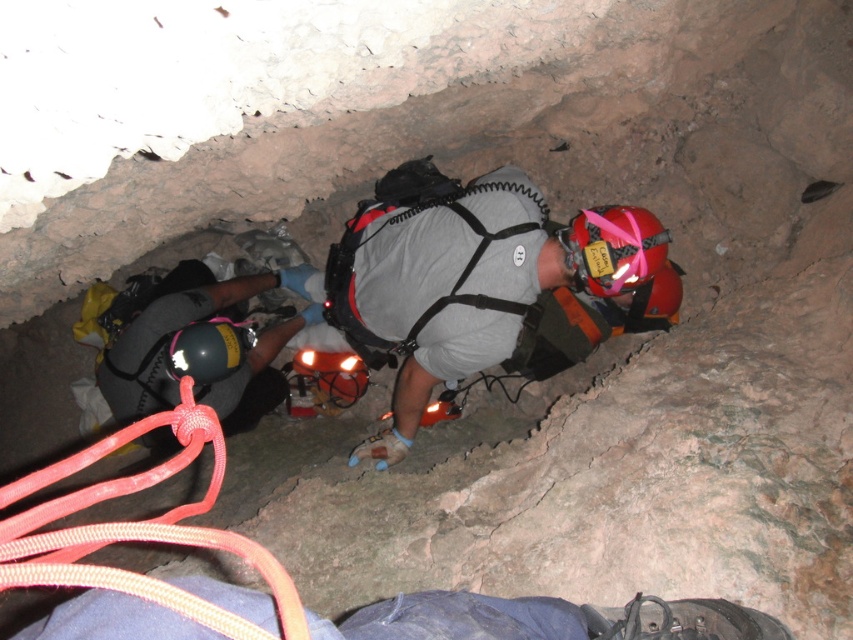
You are part of a rescue team in a cave. You need to secure a rope to the helmet to lower someone down. Which object is shorter, the red nylon rope at lower left or the brushed metal helmet at lower left? Please choose the shorter one for safety.

The red nylon rope at lower left is shorter than the brushed metal helmet at lower left, so the red nylon rope at lower left should be chosen for safety.

You are part of a rescue team in the cave. You see the blue fabric bag at lower center and the red matte helmet at center. Which object is closer to you?

The blue fabric bag at lower center is closer to you because it is in front of the red matte helmet at center.

You are a cave explorer preparing to enter a narrow passage. You have a red nylon rope at lower left that you need to use for safety. If the passage is only 20 inches wide, will the rope reach the other side?

The red nylon rope at lower left is 22.01 inches from the viewer, so it is longer than the 20 inches width of the passage. Therefore, the rope will reach the other side.